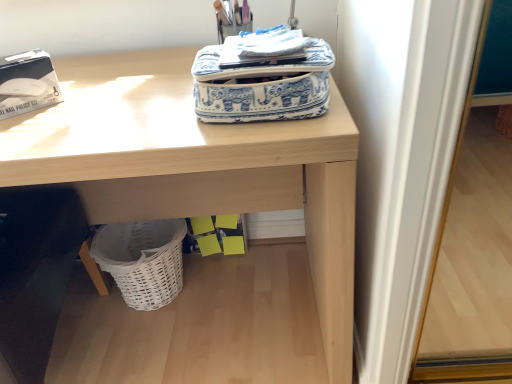
Question: Is wooden desk at upper center to the left of white wicker basket at lower left from the viewer's perspective?

Choices:
 (A) no
 (B) yes

Answer: (B)

Question: Are wooden desk at upper center and white wicker basket at lower left located far from each other?

Choices:
 (A) no
 (B) yes

Answer: (A)

Question: From the image's perspective, is wooden desk at upper center located above white wicker basket at lower left?

Choices:
 (A) no
 (B) yes

Answer: (B)

Question: Is wooden desk at upper center thinner than white wicker basket at lower left?

Choices:
 (A) yes
 (B) no

Answer: (B)

Question: Are wooden desk at upper center and white wicker basket at lower left beside each other?

Choices:
 (A) no
 (B) yes

Answer: (A)

Question: Is point (79, 127) closer or farther from the camera than point (273, 77)?

Choices:
 (A) farther
 (B) closer

Answer: (A)

Question: Considering their positions, is wooden desk at upper center located in front of or behind blue and white fabric bag at upper center?

Choices:
 (A) behind
 (B) front

Answer: (A)

Question: In terms of width, does wooden desk at upper center look wider or thinner when compared to blue and white fabric bag at upper center?

Choices:
 (A) wide
 (B) thin

Answer: (A)

Question: Would you say wooden desk at upper center is to the left or to the right of blue and white fabric bag at upper center in the picture?

Choices:
 (A) right
 (B) left

Answer: (B)

Question: Based on their sizes in the image, would you say wooden desk at upper center is bigger or smaller than white wicker basket at lower left?

Choices:
 (A) big
 (B) small

Answer: (A)

Question: Is wooden desk at upper center in front of or behind white wicker basket at lower left in the image?

Choices:
 (A) front
 (B) behind

Answer: (A)

Question: From the image's perspective, is wooden desk at upper center above or below white wicker basket at lower left?

Choices:
 (A) above
 (B) below

Answer: (A)

Question: In terms of width, does wooden desk at upper center look wider or thinner when compared to white wicker basket at lower left?

Choices:
 (A) thin
 (B) wide

Answer: (B)

Question: From the image's perspective, is blue and white fabric bag at upper center positioned above or below white wicker basket at lower left?

Choices:
 (A) above
 (B) below

Answer: (A)

Question: Considering the relative positions of blue and white fabric bag at upper center and white wicker basket at lower left in the image provided, is blue and white fabric bag at upper center to the left or to the right of white wicker basket at lower left?

Choices:
 (A) right
 (B) left

Answer: (A)